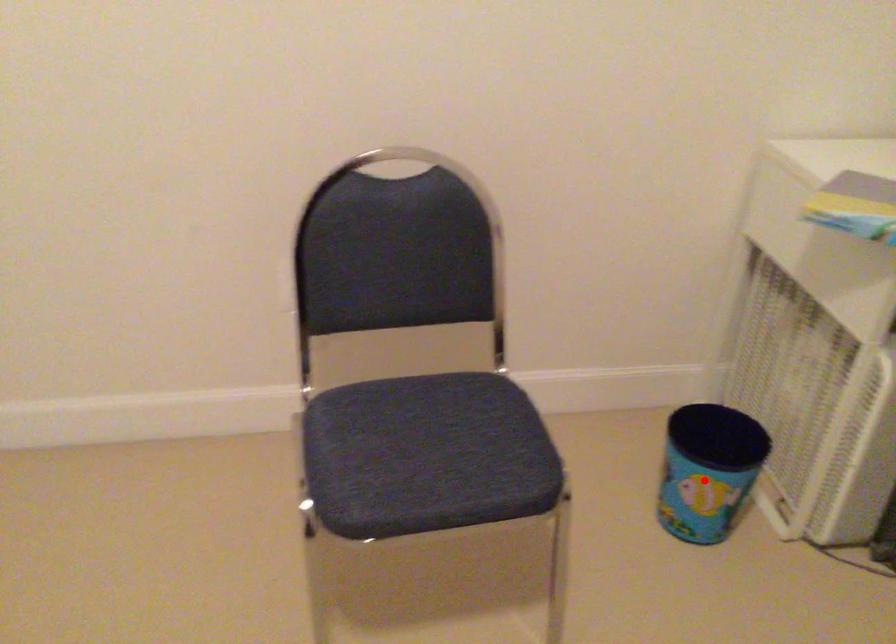
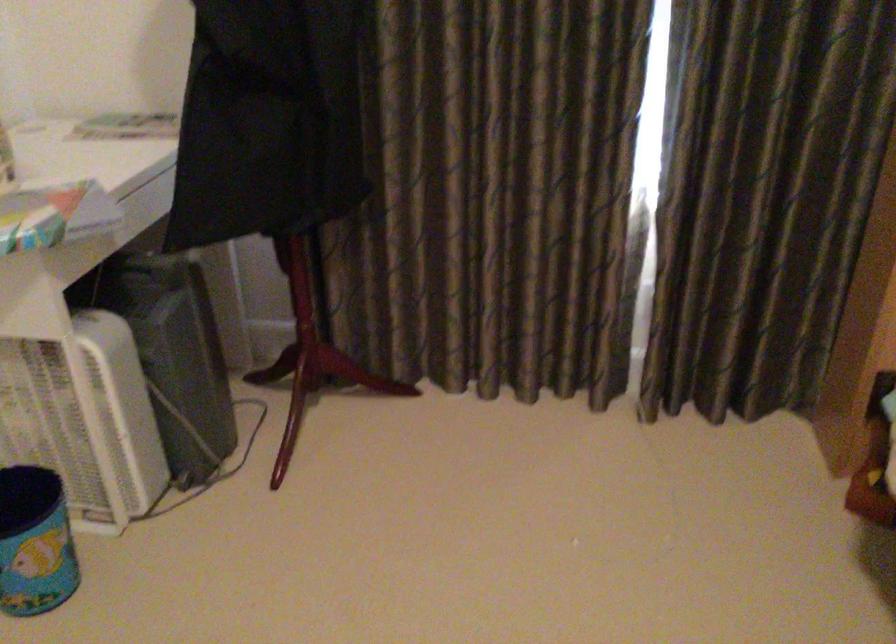
Locate, in the second image, the point that corresponds to the highlighted location in the first image.

(35, 542)